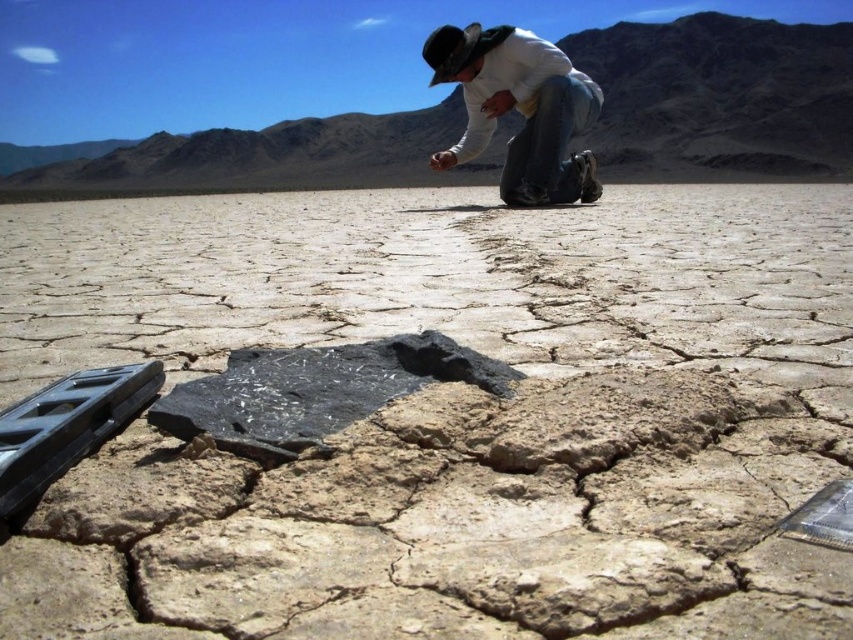
Question: Which object is farther from the camera taking this photo?

Choices:
 (A) denim jeans at center
 (B) black matte rock at center

Answer: (A)

Question: Can you confirm if black matte rock at center is positioned above denim jeans at center?

Choices:
 (A) no
 (B) yes

Answer: (A)

Question: Which object is closer to the camera taking this photo?

Choices:
 (A) denim jeans at center
 (B) black matte rock at center

Answer: (B)

Question: Is black matte rock at center bigger than denim jeans at center?

Choices:
 (A) no
 (B) yes

Answer: (A)

Question: Which point appears farthest from the camera in this image?

Choices:
 (A) (532, 80)
 (B) (447, 339)

Answer: (A)

Question: Can you confirm if black matte rock at center is bigger than denim jeans at center?

Choices:
 (A) no
 (B) yes

Answer: (A)